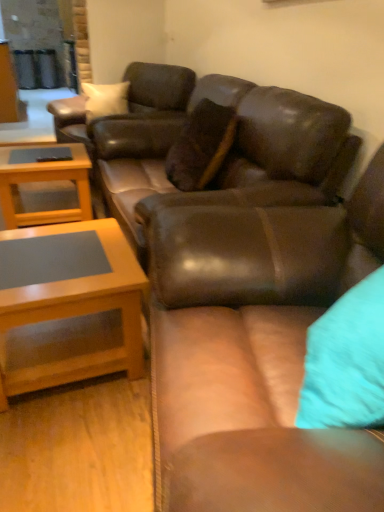
Question: From a real-world perspective, is matte brown leather couch at center, which is the 1th studio couch from back to front, over light brown wood coffee table at lower left, acting as the second coffee table starting from the back?

Choices:
 (A) yes
 (B) no

Answer: (A)

Question: Is matte brown leather couch at center, the 2th studio couch from the front, positioned before light brown wood coffee table at lower left, the 2th coffee table when ordered from top to bottom?

Choices:
 (A) no
 (B) yes

Answer: (A)

Question: Is matte brown leather couch at center, which is the 1th studio couch from back to front, to the left of light brown wood coffee table at lower left, the first coffee table positioned from the front, from the viewer's perspective?

Choices:
 (A) no
 (B) yes

Answer: (A)

Question: Is matte brown leather couch at center, which is the 1th studio couch from back to front, far from light brown wood coffee table at lower left, the first coffee table positioned from the front?

Choices:
 (A) no
 (B) yes

Answer: (A)

Question: Considering the relative positions of matte brown leather couch at center, the 2th studio couch from the front, and light brown wood coffee table at lower left, acting as the second coffee table starting from the back, in the image provided, is matte brown leather couch at center, the 2th studio couch from the front, behind light brown wood coffee table at lower left, acting as the second coffee table starting from the back,?

Choices:
 (A) yes
 (B) no

Answer: (A)

Question: Can you confirm if matte brown leather couch at center, which is the 1th studio couch from back to front, is wider than light brown wood coffee table at lower left, the 1th coffee table positioned from the bottom?

Choices:
 (A) yes
 (B) no

Answer: (A)

Question: Does matte brown leather couch at center, the 2th studio couch from the front, have a greater height compared to brown leather swivel chair at center?

Choices:
 (A) yes
 (B) no

Answer: (A)

Question: Is matte brown leather couch at center, which is the 1th studio couch from back to front, oriented towards brown leather swivel chair at center?

Choices:
 (A) no
 (B) yes

Answer: (A)

Question: Is matte brown leather couch at center, which is the 1th studio couch from back to front, looking in the opposite direction of brown leather swivel chair at center?

Choices:
 (A) no
 (B) yes

Answer: (A)

Question: Is the position of matte brown leather couch at center, the 2th studio couch from the front, more distant than that of brown leather swivel chair at center?

Choices:
 (A) no
 (B) yes

Answer: (A)

Question: Is matte brown leather couch at center, the 2th studio couch from the front, to the right of brown leather swivel chair at center from the viewer's perspective?

Choices:
 (A) no
 (B) yes

Answer: (B)

Question: Can we say matte brown leather couch at center, the 2th studio couch from the front, lies outside brown leather swivel chair at center?

Choices:
 (A) no
 (B) yes

Answer: (B)

Question: Is brown leather swivel chair at center oriented towards matte brown leather couch at center, which is the 1th studio couch from back to front?

Choices:
 (A) no
 (B) yes

Answer: (A)